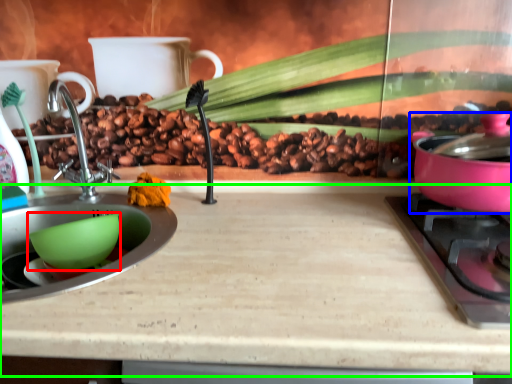
Question: Which object is the farthest from mixing bowl (highlighted by a red box)? Choose among these: kitchen appliance (highlighted by a blue box) or counter top (highlighted by a green box).

Choices:
 (A) kitchen appliance
 (B) counter top

Answer: (A)